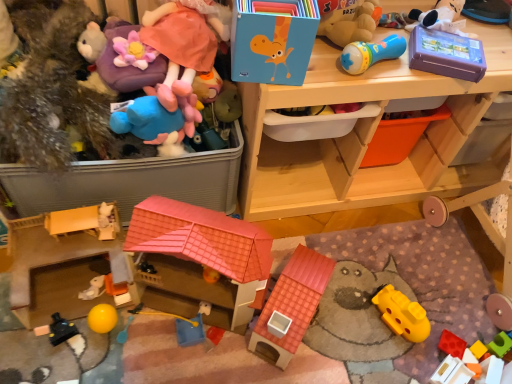
Where is `vacant space to the left of rubberized plastic blocks at lower right, placed as the fourteenth toy when sorted from left to right`? vacant space to the left of rubberized plastic blocks at lower right, placed as the fourteenth toy when sorted from left to right is located at coordinates (423, 345).